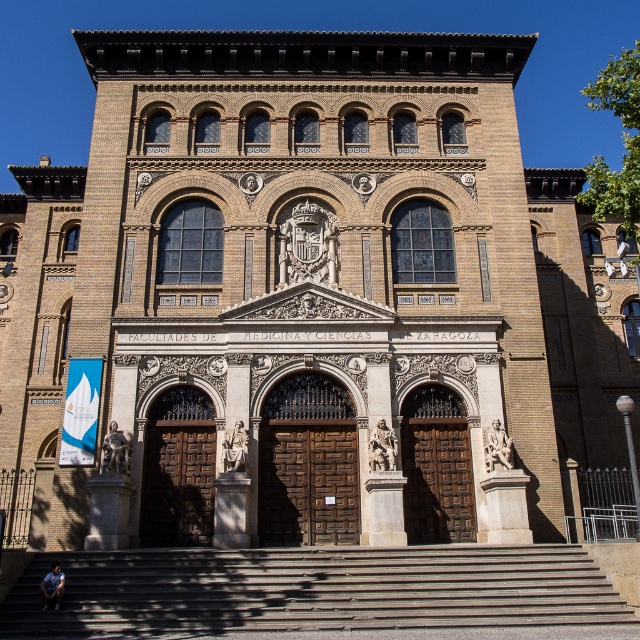
Does marble statue at right have a lesser height compared to blue denim jeans at lower left?

No.

Between marble statue at right and blue denim jeans at lower left, which one has less height?

blue denim jeans at lower left

Between point (490, 449) and point (52, 566), which one is positioned behind?

The point (490, 449) is behind.

The width and height of the screenshot is (640, 640). In order to click on marble statue at right in this screenshot , I will do `click(499, 448)`.

Can you confirm if brown wooden stairs at center is bigger than polished bronze statue at center?

Correct, brown wooden stairs at center is larger in size than polished bronze statue at center.

Does brown wooden stairs at center have a smaller size compared to polished bronze statue at center?

Incorrect, brown wooden stairs at center is not smaller in size than polished bronze statue at center.

Does point (337, 598) come in front of point (374, 465)?

Yes.

The image size is (640, 640). In order to click on brown wooden stairs at center in this screenshot , I will do `click(312, 589)`.

Is wooden door at center to the left of marble statue at right from the viewer's perspective?

Yes, wooden door at center is to the left of marble statue at right.

Which is more to the right, wooden door at center or marble statue at right?

From the viewer's perspective, marble statue at right appears more on the right side.

In order to click on wooden door at center in this screenshot , I will do `click(307, 484)`.

Locate an element on the screen. This screenshot has height=640, width=640. wooden door at center is located at coordinates (307, 484).